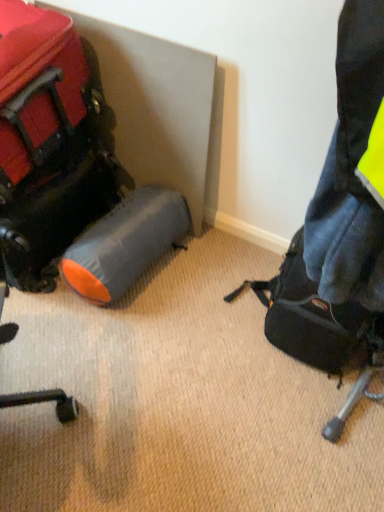
Question: Would you consider matte black suitcase at left, which ranks as the 2th luggage and bags in right-to-left order, to be distant from matte black backpack at right, the 1th luggage and bags positioned from the right?

Choices:
 (A) yes
 (B) no

Answer: (B)

Question: Is matte black suitcase at left, marked as the first luggage and bags in a left-to-right arrangement, not inside matte black backpack at right, positioned as the 2th luggage and bags in left-to-right order?

Choices:
 (A) yes
 (B) no

Answer: (A)

Question: Is matte black suitcase at left, marked as the first luggage and bags in a left-to-right arrangement, touching matte black backpack at right, positioned as the 2th luggage and bags in left-to-right order?

Choices:
 (A) no
 (B) yes

Answer: (A)

Question: From a real-world perspective, is matte black suitcase at left, which ranks as the 2th luggage and bags in right-to-left order, on matte black backpack at right, the 1th luggage and bags positioned from the right?

Choices:
 (A) yes
 (B) no

Answer: (A)

Question: Is matte black suitcase at left, which ranks as the 2th luggage and bags in right-to-left order, closer to camera compared to matte black backpack at right, positioned as the 2th luggage and bags in left-to-right order?

Choices:
 (A) yes
 (B) no

Answer: (A)

Question: From a real-world perspective, is matte black suitcase at left, which ranks as the 2th luggage and bags in right-to-left order, under matte black backpack at right, the 1th luggage and bags positioned from the right?

Choices:
 (A) yes
 (B) no

Answer: (B)

Question: From the image's perspective, is matte black backpack at right, the 1th luggage and bags positioned from the right, located above matte black suitcase at left, marked as the first luggage and bags in a left-to-right arrangement?

Choices:
 (A) yes
 (B) no

Answer: (B)

Question: Considering the relative sizes of matte black backpack at right, the 1th luggage and bags positioned from the right, and matte black suitcase at left, which ranks as the 2th luggage and bags in right-to-left order, in the image provided, is matte black backpack at right, the 1th luggage and bags positioned from the right, smaller than matte black suitcase at left, which ranks as the 2th luggage and bags in right-to-left order,?

Choices:
 (A) yes
 (B) no

Answer: (A)

Question: Could you tell me if matte black backpack at right, positioned as the 2th luggage and bags in left-to-right order, is facing matte black suitcase at left, marked as the first luggage and bags in a left-to-right arrangement?

Choices:
 (A) yes
 (B) no

Answer: (B)

Question: Is matte black backpack at right, positioned as the 2th luggage and bags in left-to-right order, to the left of matte black suitcase at left, marked as the first luggage and bags in a left-to-right arrangement, from the viewer's perspective?

Choices:
 (A) no
 (B) yes

Answer: (A)

Question: Is matte black suitcase at left, which ranks as the 2th luggage and bags in right-to-left order, at the back of matte black backpack at right, the 1th luggage and bags positioned from the right?

Choices:
 (A) yes
 (B) no

Answer: (B)

Question: From a real-world perspective, is matte black backpack at right, positioned as the 2th luggage and bags in left-to-right order, below matte black suitcase at left, which ranks as the 2th luggage and bags in right-to-left order?

Choices:
 (A) no
 (B) yes

Answer: (B)

Question: Is gray fabric sleeping bag at lower left surrounded by matte black backpack at right, positioned as the 2th luggage and bags in left-to-right order?

Choices:
 (A) no
 (B) yes

Answer: (A)